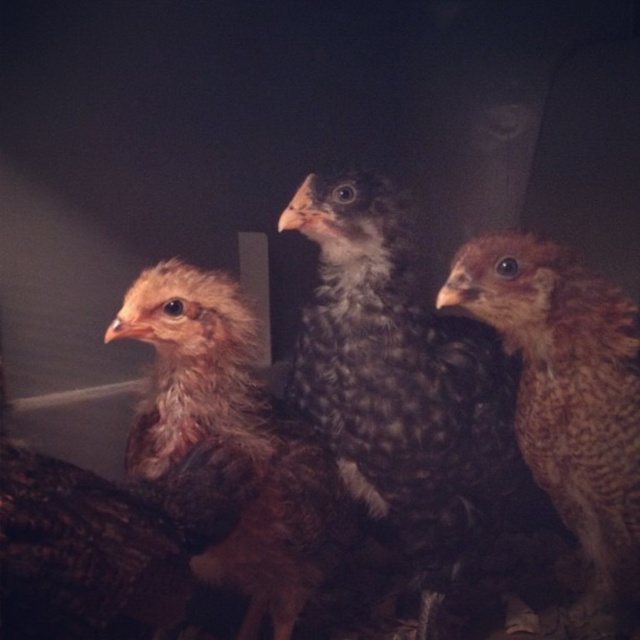
At what (x,y) coordinates should I click in order to perform the action: click on dark speckled feathers at center. Please return your answer as a coordinate pair (x, y). This screenshot has width=640, height=640. Looking at the image, I should click on (397, 381).

Consider the image. Does dark speckled feathers at center appear over brown speckled feathers at center?

Yes.

Identify the location of dark speckled feathers at center. (397, 381).

Can you confirm if brown speckled feathers at center is wider than brown speckled chicken at right?

No, brown speckled feathers at center is not wider than brown speckled chicken at right.

Looking at this image, does brown speckled feathers at center appear on the right side of brown speckled chicken at right?

Incorrect, brown speckled feathers at center is not on the right side of brown speckled chicken at right.

Does point (248, 534) come farther from viewer compared to point (634, 516)?

Yes, point (248, 534) is farther from viewer.

At what (x,y) coordinates should I click in order to perform the action: click on brown speckled feathers at center. Please return your answer as a coordinate pair (x, y). The width and height of the screenshot is (640, 640). Looking at the image, I should click on (228, 449).

Can you confirm if dark speckled feathers at center is positioned below brown speckled chicken at right?

No.

Who is more forward, (502, 404) or (532, 456)?

Positioned in front is point (532, 456).

At what (x,y) coordinates should I click in order to perform the action: click on dark speckled feathers at center. Please return your answer as a coordinate pair (x, y). The height and width of the screenshot is (640, 640). Looking at the image, I should click on (397, 381).